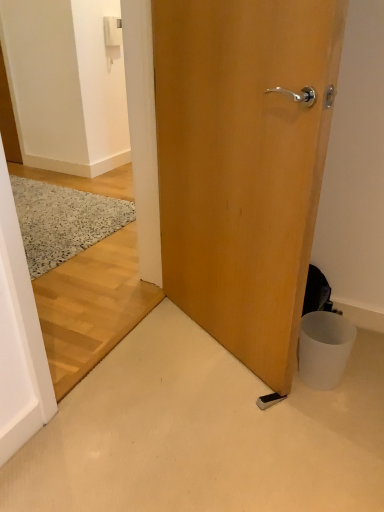
Find the location of a particular element. This screenshot has height=512, width=384. white plastic light switch at upper center is located at coordinates (112, 31).

The width and height of the screenshot is (384, 512). What do you see at coordinates (112, 31) in the screenshot? I see `white plastic light switch at upper center` at bounding box center [112, 31].

Find the location of a particular element. The width and height of the screenshot is (384, 512). speckled wool doormat at left is located at coordinates (63, 221).

What do you see at coordinates (63, 221) in the screenshot?
I see `speckled wool doormat at left` at bounding box center [63, 221].

You are a GUI agent. You are given a task and a screenshot of the screen. Output one action in this format:
    pyautogui.click(x=<x>, y=<y>)
    Task: Click on the white plastic light switch at upper center
    This screenshot has height=512, width=384.
    Given the screenshot: What is the action you would take?
    pyautogui.click(x=112, y=31)

Which of these two, wooden door at center or white plastic light switch at upper center, is bigger?

wooden door at center is bigger.

Is wooden door at center in front of white plastic light switch at upper center?

Yes, wooden door at center is closer to the viewer.

From a real-world perspective, between wooden door at center and white plastic light switch at upper center, who is vertically higher?

white plastic light switch at upper center, from a real-world perspective.

Is point (177, 267) less distant than point (109, 20)?

Yes, it is in front of point (109, 20).

Which of these two, white plastic light switch at upper center or white matte trash bin at lower right, stands taller?

white plastic light switch at upper center.

Does white plastic light switch at upper center have a greater width compared to white matte trash bin at lower right?

No, white plastic light switch at upper center is not wider than white matte trash bin at lower right.

What's the angular difference between white plastic light switch at upper center and white matte trash bin at lower right's facing directions?

They differ by 90 degrees in their facing directions.

From the image's perspective, relative to wooden door at center, is speckled wool doormat at left above or below?

speckled wool doormat at left is situated higher than wooden door at center in the image.

Considering the positions of points (79, 200) and (284, 1), is point (79, 200) closer to camera compared to point (284, 1)?

No, (79, 200) is further to viewer.

Is white matte trash bin at lower right in contact with wooden door at center?

white matte trash bin at lower right and wooden door at center are clearly separated.

In terms of height, does white matte trash bin at lower right look taller or shorter compared to wooden door at center?

In the image, white matte trash bin at lower right appears to be shorter than wooden door at center.

From a real-world perspective, is white matte trash bin at lower right positioned above or below wooden door at center?

From a real-world perspective, white matte trash bin at lower right is physically below wooden door at center.

Which is in front, point (301, 335) or point (219, 160)?

Point (219, 160)

Considering their positions, is speckled wool doormat at left located in front of or behind white plastic light switch at upper center?

speckled wool doormat at left is in front of white plastic light switch at upper center.

Consider the image. From a real-world perspective, which is physically above, speckled wool doormat at left or white plastic light switch at upper center?

white plastic light switch at upper center.

From the image's perspective, who appears lower, speckled wool doormat at left or white plastic light switch at upper center?

speckled wool doormat at left appears lower in the image.

Does speckled wool doormat at left touch white plastic light switch at upper center?

No, speckled wool doormat at left is not making contact with white plastic light switch at upper center.

Could you measure the distance between white matte trash bin at lower right and white plastic light switch at upper center?

They are 2.98 meters apart.

From a real-world perspective, is white matte trash bin at lower right on white plastic light switch at upper center?

No, from a real-world perspective, white matte trash bin at lower right is not above white plastic light switch at upper center.

Who is smaller, white matte trash bin at lower right or white plastic light switch at upper center?

With smaller size is white plastic light switch at upper center.

Is white matte trash bin at lower right in contact with white plastic light switch at upper center?

white matte trash bin at lower right and white plastic light switch at upper center are not in contact.

Is white plastic light switch at upper center wider or thinner than speckled wool doormat at left?

Considering their sizes, white plastic light switch at upper center looks slimmer than speckled wool doormat at left.

Does point (112, 18) appear closer or farther from the camera than point (97, 216)?

Point (112, 18) appears to be farther away from the viewer than point (97, 216).

Is white plastic light switch at upper center in contact with speckled wool doormat at left?

There is a gap between white plastic light switch at upper center and speckled wool doormat at left.

From the picture: Is white plastic light switch at upper center looking in the opposite direction of speckled wool doormat at left?

That's not correct — white plastic light switch at upper center is not looking away from speckled wool doormat at left.

I want to click on light switch above the wooden door at center (from the image's perspective), so click(112, 31).

The height and width of the screenshot is (512, 384). What are the coordinates of `light switch above the white matte trash bin at lower right (from a real-world perspective)` in the screenshot? It's located at (112, 31).

Considering their positions, is speckled wool doormat at left positioned closer to wooden door at center than white plastic light switch at upper center?

Based on the image, speckled wool doormat at left appears to be nearer to wooden door at center.

When comparing their distances from white plastic light switch at upper center, does wooden door at center or speckled wool doormat at left seem further?

wooden door at center.

Considering their positions, is white matte trash bin at lower right positioned further to white plastic light switch at upper center than speckled wool doormat at left?

white matte trash bin at lower right.

When comparing their distances from white matte trash bin at lower right, does speckled wool doormat at left or white plastic light switch at upper center seem further?

The object further to white matte trash bin at lower right is white plastic light switch at upper center.

When comparing their distances from speckled wool doormat at left, does white matte trash bin at lower right or wooden door at center seem further?

Among the two, white matte trash bin at lower right is located further to speckled wool doormat at left.

When comparing their distances from speckled wool doormat at left, does white plastic light switch at upper center or wooden door at center seem closer?

Based on the image, wooden door at center appears to be nearer to speckled wool doormat at left.

Which object lies further to the anchor point wooden door at center, speckled wool doormat at left or white matte trash bin at lower right?

speckled wool doormat at left lies further to wooden door at center than the other object.

From the image, which object appears to be farther from wooden door at center, white matte trash bin at lower right or white plastic light switch at upper center?

Among the two, white plastic light switch at upper center is located further to wooden door at center.

Where is `doormat between white plastic light switch at upper center and white matte trash bin at lower right in the vertical direction`? The image size is (384, 512). doormat between white plastic light switch at upper center and white matte trash bin at lower right in the vertical direction is located at coordinates (63, 221).

Find the location of a particular element. This screenshot has height=512, width=384. trash bin/can located between wooden door at center and white plastic light switch at upper center in the depth direction is located at coordinates (324, 348).

Find the location of a particular element. Image resolution: width=384 pixels, height=512 pixels. door situated between speckled wool doormat at left and white matte trash bin at lower right from left to right is located at coordinates (243, 164).

Locate an element on the screen. doormat between wooden door at center and white plastic light switch at upper center from front to back is located at coordinates (63, 221).